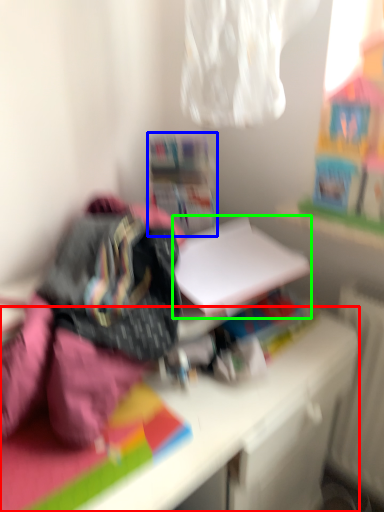
Question: Which object is the farthest from desk (highlighted by a red box)? Choose among these: shelf (highlighted by a blue box) or paperback book (highlighted by a green box).

Choices:
 (A) shelf
 (B) paperback book

Answer: (A)